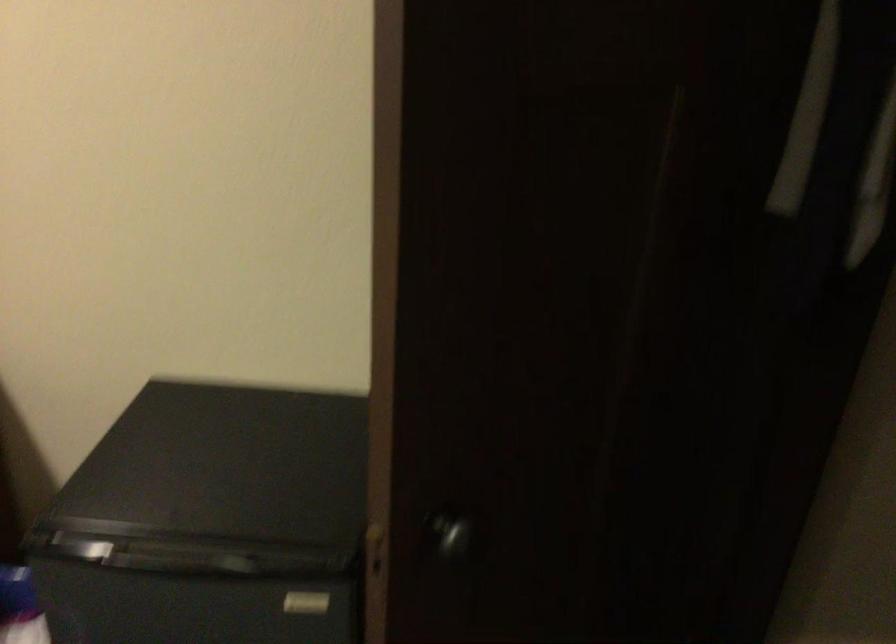
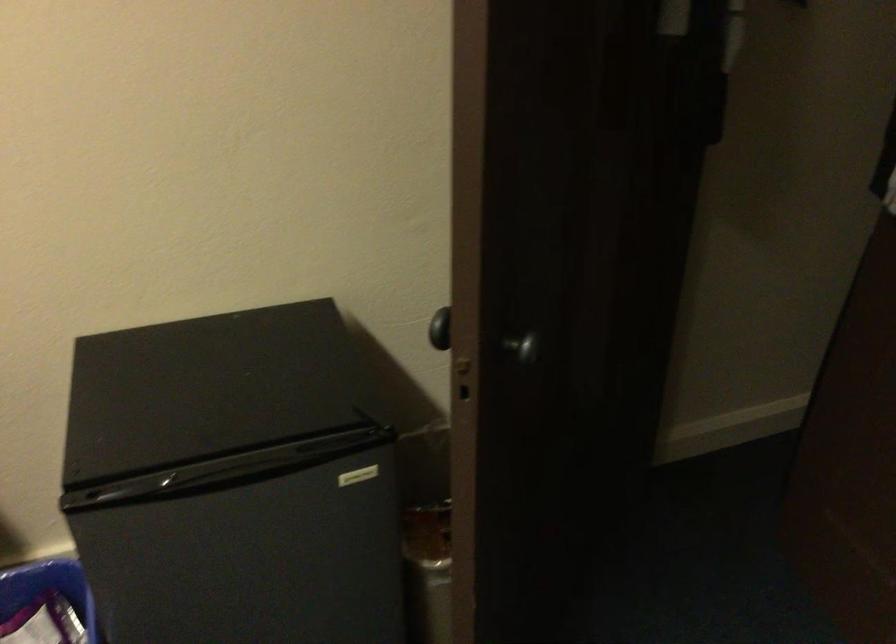
Question: Which direction would the cameraman need to move to produce the second image? Reply with the corresponding letter.

Choices:
 (A) Left
 (B) Right
 (C) Forward
 (D) Backward

Answer: (A)